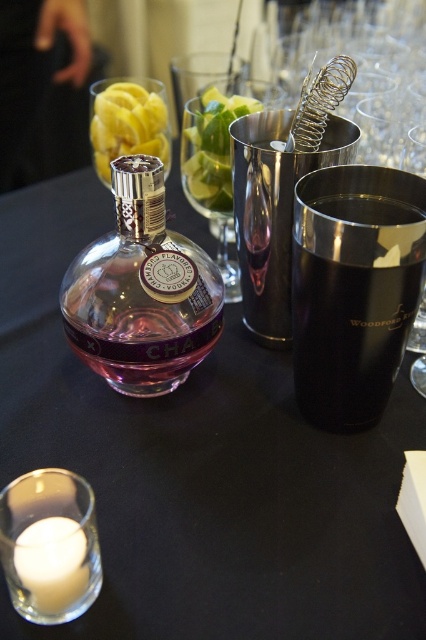
Looking at this image, who is positioned more to the left, yellow matte lemon at upper left or white wax candle at lower left?

Positioned to the left is white wax candle at lower left.

Is yellow matte lemon at upper left to the left of white wax candle at lower left from the viewer's perspective?

Incorrect, yellow matte lemon at upper left is not on the left side of white wax candle at lower left.

Where is `yellow matte lemon at upper left`? yellow matte lemon at upper left is located at coordinates (126, 124).

Which is behind, point (313, 243) or point (146, 252)?

The point (146, 252) is more distant.

Can you confirm if black matte cup at right is positioned above pink glass bottle at center?

No, black matte cup at right is not above pink glass bottle at center.

Does point (347, 250) lie in front of point (103, 264)?

Yes, point (347, 250) is in front of point (103, 264).

Find the location of a particular element. black matte cup at right is located at coordinates (354, 289).

Does black matte cup at right lie behind white wax candle at lower left?

Yes, it is.

Between black matte cup at right and white wax candle at lower left, which one is positioned higher?

black matte cup at right is higher up.

The image size is (426, 640). What do you see at coordinates (354, 289) in the screenshot?
I see `black matte cup at right` at bounding box center [354, 289].

At what (x,y) coordinates should I click in order to perform the action: click on black matte cup at right. Please return your answer as a coordinate pair (x, y). The image size is (426, 640). Looking at the image, I should click on (354, 289).